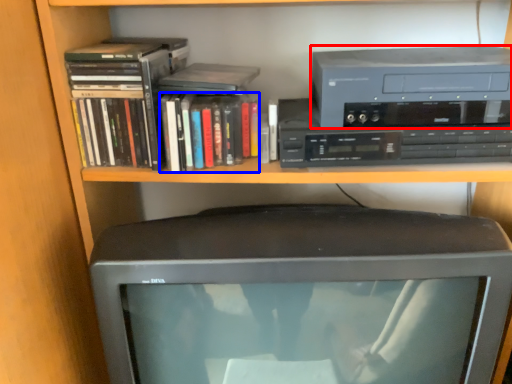
Question: Which object is closer to the camera taking this photo, cassette (highlighted by a red box) or book (highlighted by a blue box)?

Choices:
 (A) cassette
 (B) book

Answer: (A)